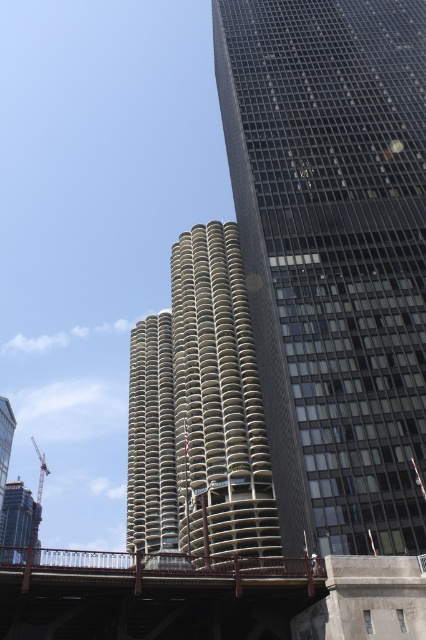
You are standing at the origin point of the coordinate system in this image. Which direction should you move to reach the dark gray concrete building at lower left?

Since the dark gray concrete building at lower left is located at coordinate point 0.817 on the x axis and 0.038 on the y axis, you should move towards the positive x direction and negative y direction to reach it.

You are a construction worker standing on the roof of the dark gray concrete building at lower left and need to reach the metallic safety harness at lower center. Can you climb directly upwards from your current position to reach it?

The dark gray concrete building at lower left is located below the metallic safety harness at lower center, so yes, you can climb directly upwards from the dark gray concrete building at lower left to reach the metallic safety harness at lower center.

You are a city planner analyzing the skyline. Given the scene, which of the two buildings at the center, the dark glass skyscraper at center or the beige concrete tower at center, has a greater height?

The dark glass skyscraper at center is taller than the beige concrete tower at center, so it has a greater height.